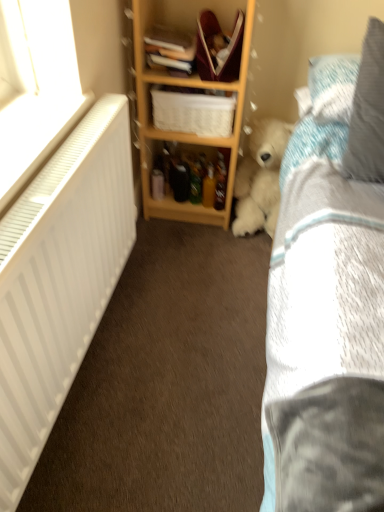
Locate an element on the screen. This screenshot has height=512, width=384. hardcover book at upper center, the 1th book from the bottom is located at coordinates (170, 50).

How much space does hardcover book at upper center, which ranks as the second book in bottom-to-top order, occupy vertically?

hardcover book at upper center, which ranks as the second book in bottom-to-top order, is 2.01 inches tall.

Describe the element at coordinates (368, 111) in the screenshot. I see `gray fabric pillow at upper right, positioned as the second pillow in back-to-front order` at that location.

Image resolution: width=384 pixels, height=512 pixels. In order to click on blue textured pillow at upper right, which ranks as the first pillow in back-to-front order in this screenshot , I will do `click(332, 86)`.

What is the approximate height of wooden shelf at center?

It is 37.47 inches.

Identify the location of white woven basket at center. (193, 111).

Based on the photo, is hardcover book at upper center, the 1th book positioned from the top, far away from wooden shelf at center?

hardcover book at upper center, the 1th book positioned from the top, is near wooden shelf at center, not far away.

Can you confirm if hardcover book at upper center, which ranks as the second book in bottom-to-top order, is shorter than wooden shelf at center?

Correct, hardcover book at upper center, which ranks as the second book in bottom-to-top order, is not as tall as wooden shelf at center.

Based on their positions, is hardcover book at upper center, which ranks as the second book in bottom-to-top order, located to the left or right of wooden shelf at center?

From the image, it's evident that hardcover book at upper center, which ranks as the second book in bottom-to-top order, is to the left of wooden shelf at center.

Between hardcover book at upper center, the 1th book positioned from the top, and wooden shelf at center, which one has smaller size?

hardcover book at upper center, the 1th book positioned from the top, is smaller.

Which of these two, white plastic radiator at left or gray fabric pillow at upper right, positioned as the second pillow in back-to-front order, is bigger?

gray fabric pillow at upper right, positioned as the second pillow in back-to-front order.

Which pillow is the 2nd one when counting from the right side of the white plastic radiator at left? Please provide its 2D coordinates.

[(368, 111)]

Could you tell me if white plastic radiator at left is facing gray fabric pillow at upper right, arranged as the 1th pillow when viewed from the front?

Yes.

Measure the distance between white plastic radiator at left and hardcover book at upper center, which ranks as the second book in bottom-to-top order.

white plastic radiator at left is 22.42 inches away from hardcover book at upper center, which ranks as the second book in bottom-to-top order.

In the scene shown: Which of these two, white plastic radiator at left or hardcover book at upper center, the 1th book positioned from the top, is smaller?

hardcover book at upper center, the 1th book positioned from the top, is smaller.

Would you say white plastic radiator at left is to the left or to the right of hardcover book at upper center, which ranks as the second book in bottom-to-top order, in the picture?

From the image, it's evident that white plastic radiator at left is to the left of hardcover book at upper center, which ranks as the second book in bottom-to-top order.

How different are the orientations of white plastic radiator at left and hardcover book at upper center, which ranks as the second book in bottom-to-top order, in degrees?

The angle between the facing direction of white plastic radiator at left and the facing direction of hardcover book at upper center, which ranks as the second book in bottom-to-top order, is 86.9 degrees.

From the picture: Is blue textured pillow at upper right, positioned as the 2th pillow in front-to-back order, behind gray fabric pillow at upper right, arranged as the 1th pillow when viewed from the front?

Yes, it is behind gray fabric pillow at upper right, arranged as the 1th pillow when viewed from the front.

Considering the sizes of objects blue textured pillow at upper right, positioned as the 2th pillow in front-to-back order, and gray fabric pillow at upper right, positioned as the second pillow in back-to-front order, in the image provided, who is bigger, blue textured pillow at upper right, positioned as the 2th pillow in front-to-back order, or gray fabric pillow at upper right, positioned as the second pillow in back-to-front order,?

gray fabric pillow at upper right, positioned as the second pillow in back-to-front order.

How different are the orientations of blue textured pillow at upper right, which ranks as the first pillow in back-to-front order, and gray fabric pillow at upper right, positioned as the second pillow in back-to-front order, in degrees?

There is a 9.33-degree angle between the facing directions of blue textured pillow at upper right, which ranks as the first pillow in back-to-front order, and gray fabric pillow at upper right, positioned as the second pillow in back-to-front order.

Can you see blue textured pillow at upper right, which ranks as the first pillow in back-to-front order, touching gray fabric pillow at upper right, arranged as the 1th pillow when viewed from the front?

No.

Consider the image. Considering the relative positions of gray fabric pillow at upper right, positioned as the second pillow in back-to-front order, and white plastic radiator at left in the image provided, is gray fabric pillow at upper right, positioned as the second pillow in back-to-front order, in front of white plastic radiator at left?

No.

Is gray fabric pillow at upper right, arranged as the 1th pillow when viewed from the front, aimed at white plastic radiator at left?

No, gray fabric pillow at upper right, arranged as the 1th pillow when viewed from the front, is not oriented towards white plastic radiator at left.

From a real-world perspective, is gray fabric pillow at upper right, arranged as the 1th pillow when viewed from the front, physically located above or below white plastic radiator at left?

From a real-world perspective, gray fabric pillow at upper right, arranged as the 1th pillow when viewed from the front, is physically above white plastic radiator at left.

Considering the relative sizes of gray fabric pillow at upper right, positioned as the second pillow in back-to-front order, and white plastic radiator at left in the image provided, is gray fabric pillow at upper right, positioned as the second pillow in back-to-front order, shorter than white plastic radiator at left?

In fact, gray fabric pillow at upper right, positioned as the second pillow in back-to-front order, may be taller than white plastic radiator at left.

Is white woven basket at center far from fluffy white teddy bear at lower right?

No, white woven basket at center is not far away from fluffy white teddy bear at lower right.

From their relative heights in the image, would you say white woven basket at center is taller or shorter than fluffy white teddy bear at lower right?

In the image, white woven basket at center appears to be shorter than fluffy white teddy bear at lower right.

From a real-world perspective, which object rests below the other?

fluffy white teddy bear at lower right, from a real-world perspective.

Which point is more distant from viewer, (199, 122) or (251, 223)?

Positioned behind is point (251, 223).

From the image's perspective, between white plastic radiator at left and blue textured pillow at upper right, positioned as the 2th pillow in front-to-back order, which one is located above?

blue textured pillow at upper right, positioned as the 2th pillow in front-to-back order.

In order to click on window frame located below the blue textured pillow at upper right, positioned as the 2th pillow in front-to-back order (from the image's perspective) in this screenshot , I will do click(x=38, y=89).

Is point (12, 44) positioned before point (333, 64)?

Yes, it is.

Considering the sizes of objects white plastic radiator at left and blue textured pillow at upper right, positioned as the 2th pillow in front-to-back order, in the image provided, who is smaller, white plastic radiator at left or blue textured pillow at upper right, positioned as the 2th pillow in front-to-back order,?

Smaller between the two is white plastic radiator at left.

From the wooden shelf at center, count the 2nd book to the left and point to it. Please provide its 2D coordinates.

[(168, 38)]

From the image's perspective, count 1st pillows upward from the white plastic radiator at left and point to it. Please provide its 2D coordinates.

[(368, 111)]

From the image, which object appears to be farther from wooden shelf at center, white plastic radiator at left or fluffy white teddy bear at lower right?

Among the two, white plastic radiator at left is located further to wooden shelf at center.

Estimate the real-world distances between objects in this image. Which object is further from white plastic radiator at left, blue textured pillow at upper right, positioned as the 2th pillow in front-to-back order, or wooden shelf at center?

blue textured pillow at upper right, positioned as the 2th pillow in front-to-back order, is further to white plastic radiator at left.

From the picture: Looking at the image, which one is located further to hardcover book at upper center, the 1th book from the bottom, blue textured pillow at upper right, which ranks as the first pillow in back-to-front order, or white plastic radiator at left?

Based on the image, white plastic radiator at left appears to be further to hardcover book at upper center, the 1th book from the bottom.

Considering their positions, is blue textured pillow at upper right, positioned as the 2th pillow in front-to-back order, positioned closer to wooden shelf at center than hardcover book at upper center, which ranks as the second book in bottom-to-top order?

Among the two, hardcover book at upper center, which ranks as the second book in bottom-to-top order, is located nearer to wooden shelf at center.

Looking at this image, from the image, which object appears to be nearer to hardcover book at upper center, which ranks as the second book in bottom-to-top order, fluffy white teddy bear at lower right or hardcover book at upper center, the 1th book from the bottom?

hardcover book at upper center, the 1th book from the bottom.

Considering their positions, is wooden shelf at center positioned further to hardcover book at upper center, which ranks as the second book in bottom-to-top order, than hardcover book at upper center, marked as the second book in a top-to-bottom arrangement?

wooden shelf at center is further to hardcover book at upper center, which ranks as the second book in bottom-to-top order.

Which object lies nearer to the anchor point fluffy white teddy bear at lower right, gray fabric pillow at upper right, arranged as the 1th pillow when viewed from the front, or white plastic radiator at left?

The object closer to fluffy white teddy bear at lower right is gray fabric pillow at upper right, arranged as the 1th pillow when viewed from the front.

From the image, which object appears to be nearer to fluffy white teddy bear at lower right, hardcover book at upper center, the 1th book from the bottom, or wooden shelf at center?

Based on the image, wooden shelf at center appears to be nearer to fluffy white teddy bear at lower right.

Image resolution: width=384 pixels, height=512 pixels. Identify the location of teddy bear between white plastic radiator at left and gray fabric pillow at upper right, positioned as the second pillow in back-to-front order, in the horizontal direction. (260, 178).

This screenshot has width=384, height=512. What are the coordinates of `pillow between hardcover book at upper center, marked as the second book in a top-to-bottom arrangement, and gray fabric pillow at upper right, positioned as the second pillow in back-to-front order, in the horizontal direction` in the screenshot? It's located at (332, 86).

The width and height of the screenshot is (384, 512). I want to click on teddy bear between hardcover book at upper center, marked as the second book in a top-to-bottom arrangement, and gray fabric pillow at upper right, positioned as the second pillow in back-to-front order, so click(x=260, y=178).

The image size is (384, 512). What are the coordinates of `basket between hardcover book at upper center, the 1th book positioned from the top, and gray fabric pillow at upper right, arranged as the 1th pillow when viewed from the front` in the screenshot? It's located at (193, 111).